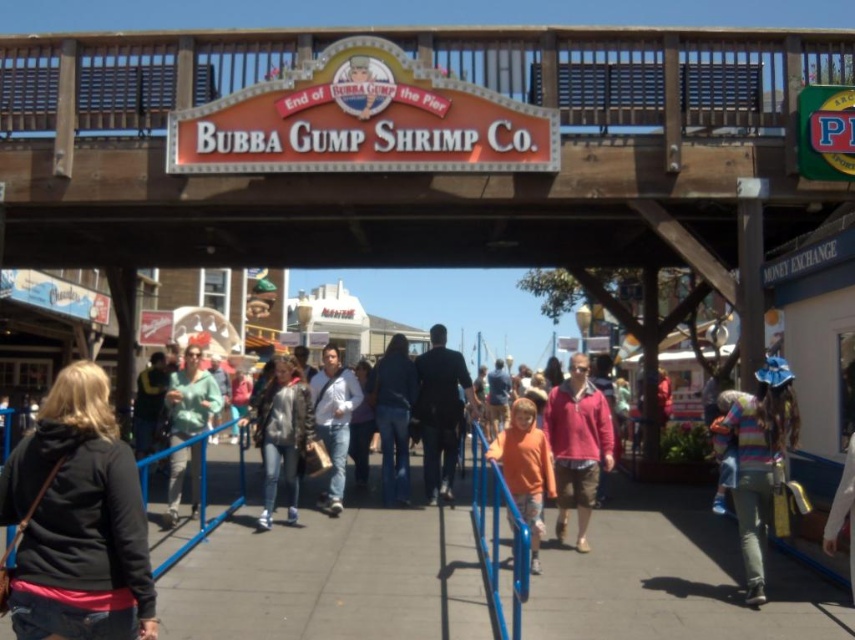
Is leather jacket at center smaller than denim pants at center?

Correct, leather jacket at center occupies less space than denim pants at center.

Who is more forward, (310, 397) or (381, 378)?

Positioned in front is point (310, 397).

Which is behind, point (301, 456) or point (399, 480)?

The point (399, 480) is behind.

Image resolution: width=855 pixels, height=640 pixels. I want to click on leather jacket at center, so [x=282, y=435].

Is orange cotton shirt at center further to the viewer compared to white matte shirt at center?

That is False.

Does orange cotton shirt at center have a greater width compared to white matte shirt at center?

No.

Image resolution: width=855 pixels, height=640 pixels. Describe the element at coordinates (525, 468) in the screenshot. I see `orange cotton shirt at center` at that location.

Locate an element on the screen. This screenshot has width=855, height=640. orange cotton shirt at center is located at coordinates point(525,468).

Between pink matte sweater at center and matte green sweater at center, which one is positioned higher?

Positioned higher is matte green sweater at center.

Can you confirm if pink matte sweater at center is thinner than matte green sweater at center?

Yes, pink matte sweater at center is thinner than matte green sweater at center.

At what (x,y) coordinates should I click in order to perform the action: click on pink matte sweater at center. Please return your answer as a coordinate pair (x, y). Image resolution: width=855 pixels, height=640 pixels. Looking at the image, I should click on (576, 445).